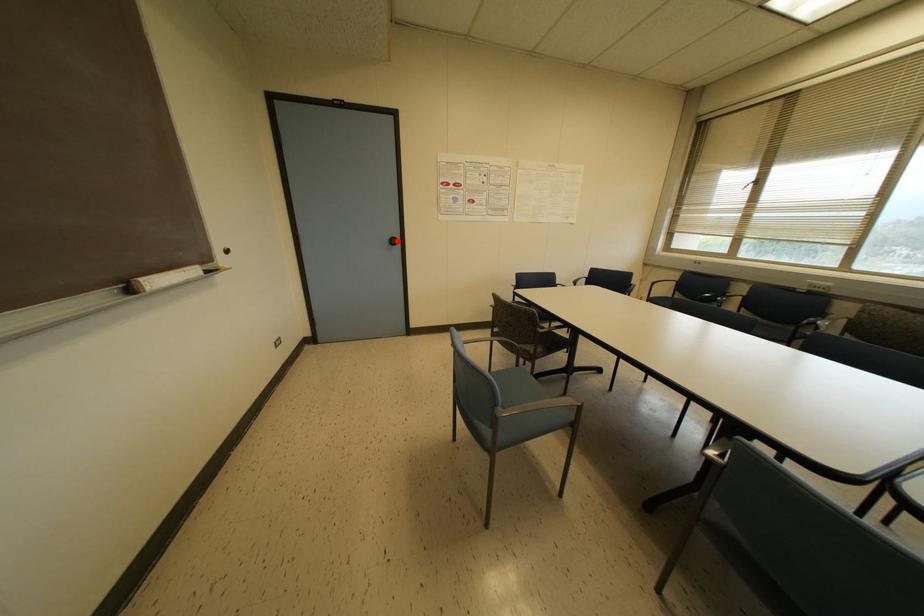
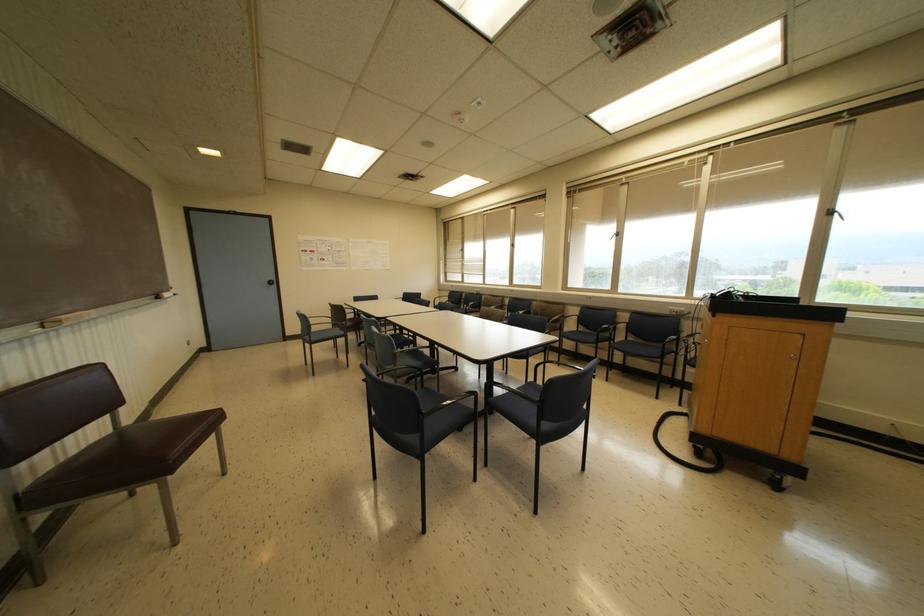
Locate, in the second image, the point that corresponds to the highlighted location in the first image.

(274, 282)